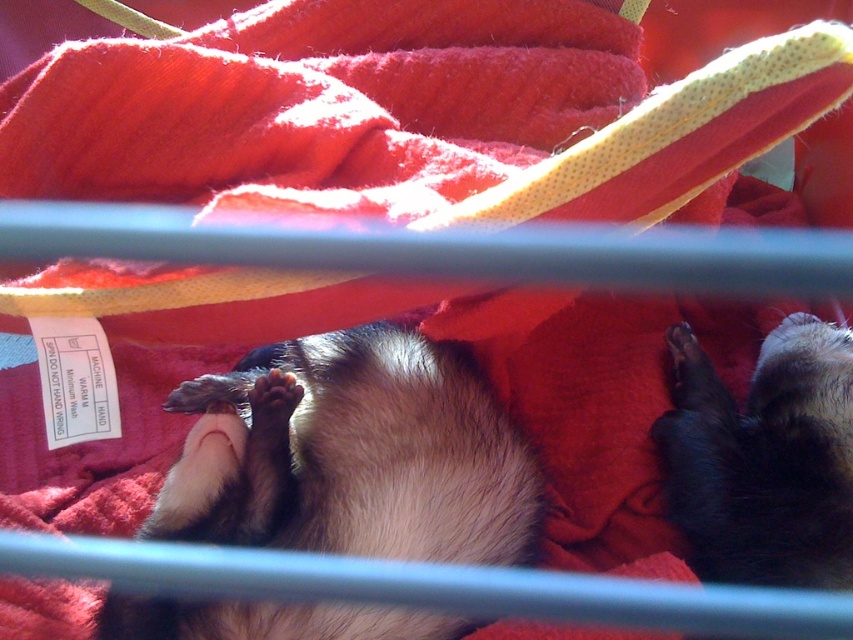
Between fuzzy fur animal at center and black fur animal at lower right, which one has less height?

With less height is black fur animal at lower right.

Which is behind, point (157, 522) or point (793, 340)?

Positioned behind is point (793, 340).

At what (x,y) coordinates should I click in order to perform the action: click on fuzzy fur animal at center. Please return your answer as a coordinate pair (x, y). Looking at the image, I should click on (358, 454).